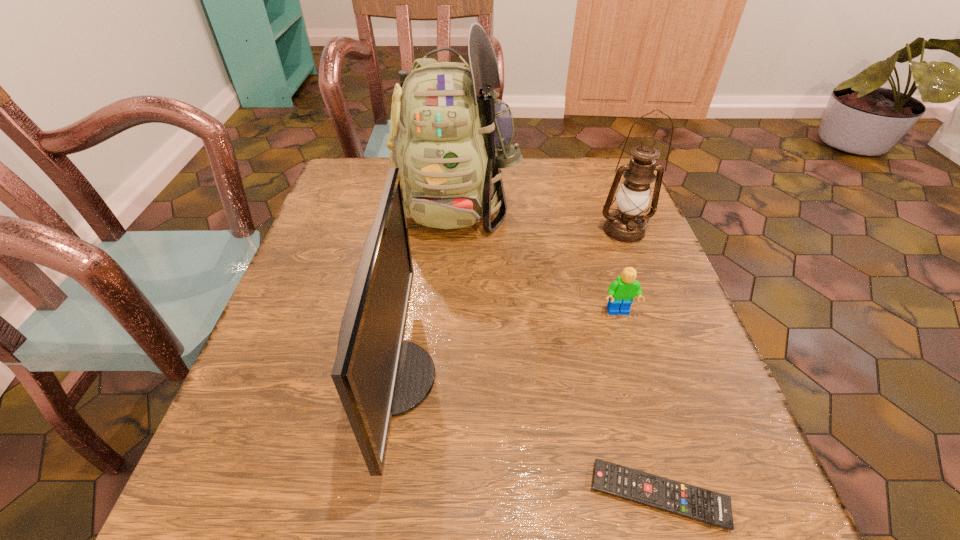
At what (x,y) coordinates should I click in order to perform the action: click on backpack. Please return your answer as a coordinate pair (x, y). Image resolution: width=960 pixels, height=540 pixels. Looking at the image, I should click on tap(450, 137).

Locate an element on the screen. The height and width of the screenshot is (540, 960). oil lamp is located at coordinates (625, 225).

Find the location of `monitor`. monitor is located at coordinates (378, 375).

I want to click on Lego, so click(x=621, y=292).

The width and height of the screenshot is (960, 540). Find the location of `remote control`. remote control is located at coordinates coord(706,506).

At what (x,y) coordinates should I click in order to perform the action: click on free spot located 0.380m on the front-facing side of the backpack. Please return your answer as a coordinate pair (x, y). Image resolution: width=960 pixels, height=540 pixels. Looking at the image, I should click on (441, 401).

The height and width of the screenshot is (540, 960). Find the location of `free space located 0.130m on the back of the oil lamp`. free space located 0.130m on the back of the oil lamp is located at coordinates (608, 188).

Locate an element on the screen. blank space located 0.070m on the screen side of the monitor is located at coordinates (478, 378).

I want to click on vacant space located on the face of the second shortest object, so click(668, 478).

Locate an element on the screen. vacant space located on the back of the remote control is located at coordinates (640, 429).